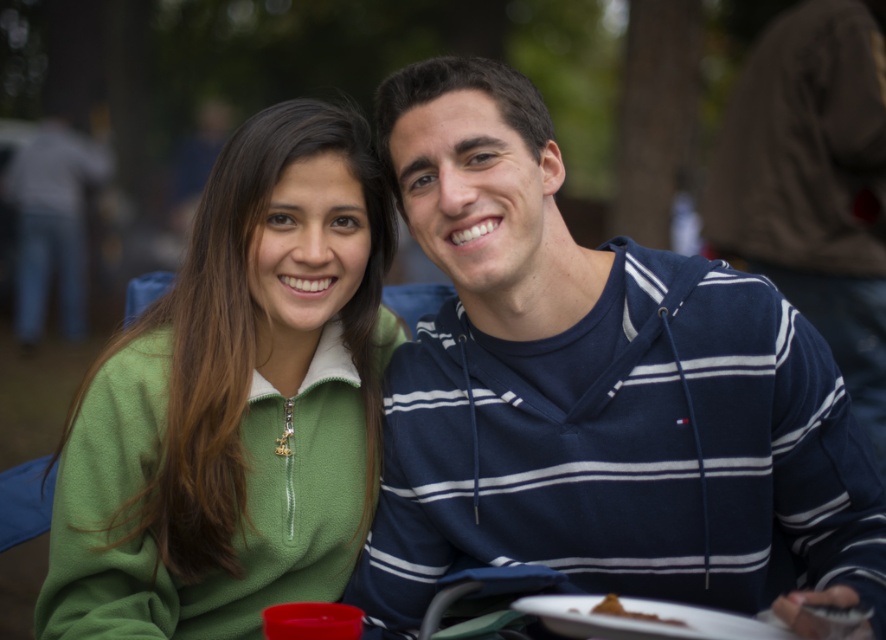
Is blue striped hoodie at center bigger than white plastic plate at lower center?

Indeed, blue striped hoodie at center has a larger size compared to white plastic plate at lower center.

Who is more forward, (828, 298) or (623, 628)?

Point (623, 628) is in front.

Where is `blue striped hoodie at center`? This screenshot has width=886, height=640. blue striped hoodie at center is located at coordinates (814, 182).

Which is behind, point (602, 636) or point (596, 609)?

The point (596, 609) is more distant.

Can you confirm if white plastic plate at lower center is positioned to the right of brown crumbly pastry at lower center?

Correct, you'll find white plastic plate at lower center to the right of brown crumbly pastry at lower center.

Is point (577, 612) farther from camera compared to point (641, 620)?

Yes.

Locate an element on the screen. white plastic plate at lower center is located at coordinates (642, 620).

Can you confirm if green fleece jacket at left is thinner than blue striped hoodie at center?

Yes.

Is point (200, 582) behind point (799, 16)?

No.

This screenshot has width=886, height=640. Find the location of `green fleece jacket at left`. green fleece jacket at left is located at coordinates (235, 403).